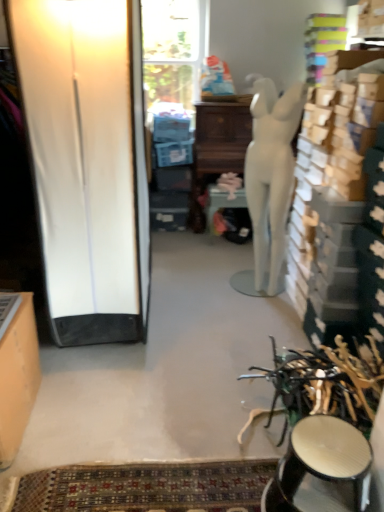
Locate an element on the screen. This screenshot has height=512, width=384. free space to the right of white glossy screen door at left is located at coordinates pyautogui.click(x=205, y=312).